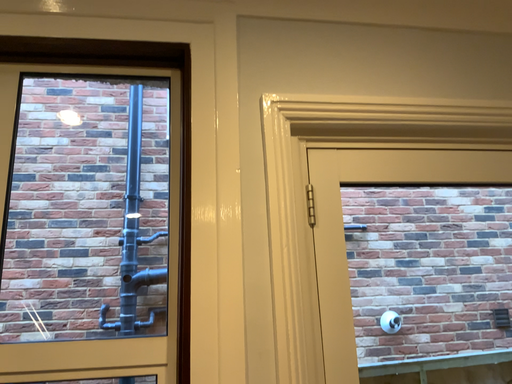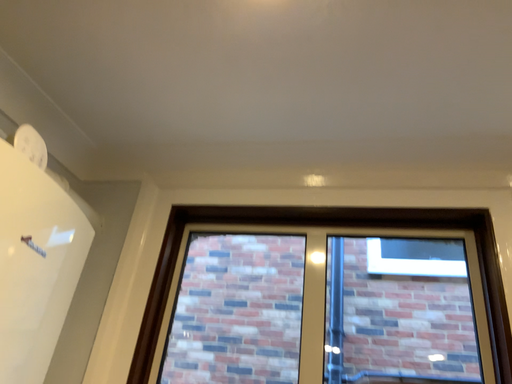
Question: How did the camera likely rotate when shooting the video?

Choices:
 (A) rotated upward
 (B) rotated downward

Answer: (A)